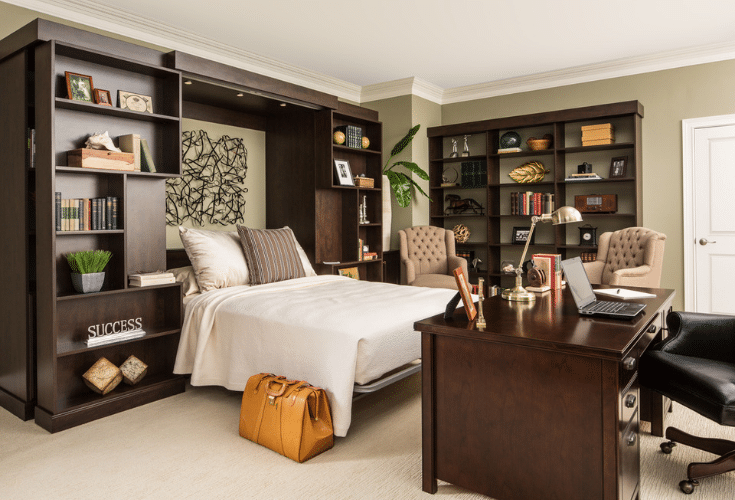
What are the coordinates of `pillows` in the screenshot? It's located at (215, 268), (297, 242).